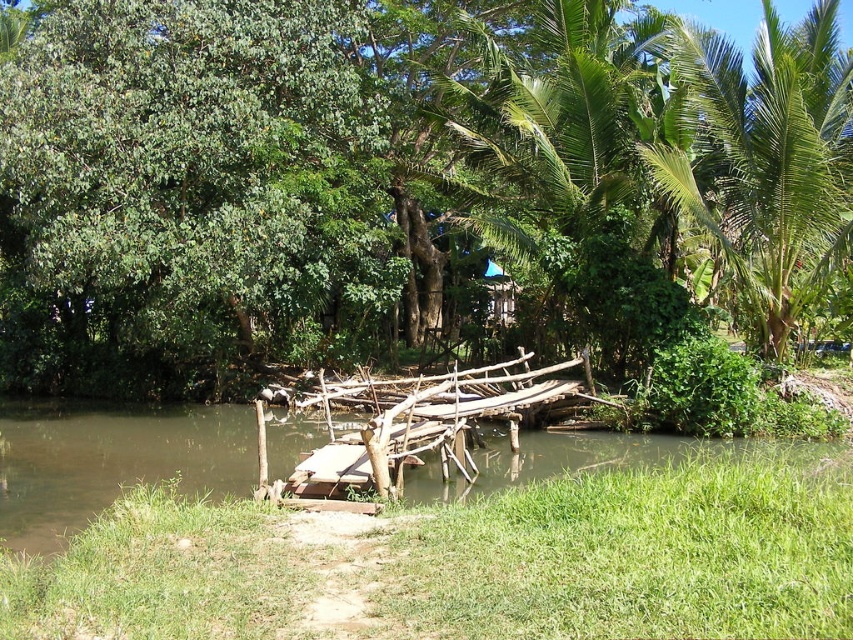
You are a hiker who wants to cross the brown wooden bridge at center to reach the green leafy tree at center. Is the bridge positioned in a way that allows you to walk directly towards the tree from the bridge?

The green leafy tree at center is to the right of brown wooden bridge at center, so you would need to walk towards the right side of the bridge to reach the tree.

You are standing at the edge of the water in the serene natural setting and see two points marked in the image. Which point is closer to you, point (183, 212) or point (809, 116)?

Point (183, 212) is closer to you because it is further to the viewer than point (809, 116).